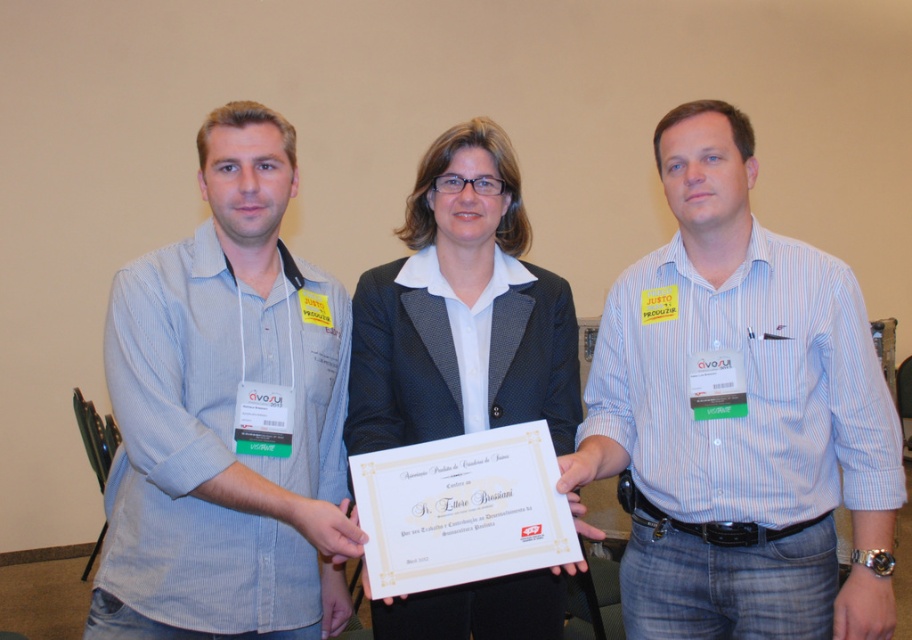
Is point (726, 298) positioned in front of point (245, 200)?

No, it is not.

Is blue striped shirt at center above light blue striped shirt at center?

Correct, blue striped shirt at center is located above light blue striped shirt at center.

Is point (890, 621) positioned after point (168, 628)?

Yes, it is behind point (168, 628).

You are a GUI agent. You are given a task and a screenshot of the screen. Output one action in this format:
    pyautogui.click(x=<x>, y=<y>)
    Task: Click on the blue striped shirt at center
    Image resolution: width=912 pixels, height=640 pixels.
    Given the screenshot: What is the action you would take?
    pyautogui.click(x=739, y=413)